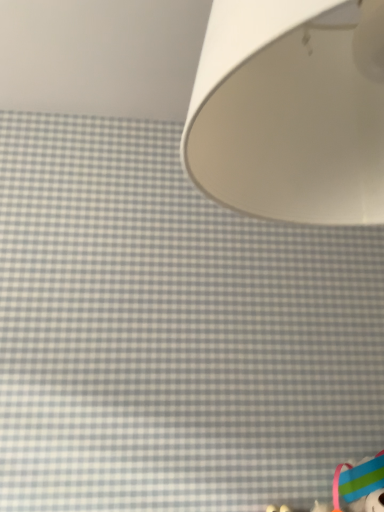
Question: Can you confirm if white matte lampshade at upper right is thinner than rubberized plastic toy at lower right?

Choices:
 (A) yes
 (B) no

Answer: (B)

Question: Does white matte lampshade at upper right have a lesser height compared to rubberized plastic toy at lower right?

Choices:
 (A) yes
 (B) no

Answer: (B)

Question: Is white matte lampshade at upper right at the right side of rubberized plastic toy at lower right?

Choices:
 (A) yes
 (B) no

Answer: (B)

Question: Is white matte lampshade at upper right not close to rubberized plastic toy at lower right?

Choices:
 (A) no
 (B) yes

Answer: (B)

Question: Considering the relative positions of white matte lampshade at upper right and rubberized plastic toy at lower right in the image provided, is white matte lampshade at upper right in front of rubberized plastic toy at lower right?

Choices:
 (A) yes
 (B) no

Answer: (A)

Question: Is white matte lampshade at upper right not within rubberized plastic toy at lower right?

Choices:
 (A) yes
 (B) no

Answer: (A)

Question: Is rubberized plastic toy at lower right positioned with its back to white matte lampshade at upper right?

Choices:
 (A) no
 (B) yes

Answer: (A)

Question: Is rubberized plastic toy at lower right at the left side of white matte lampshade at upper right?

Choices:
 (A) no
 (B) yes

Answer: (A)

Question: Is rubberized plastic toy at lower right aimed at white matte lampshade at upper right?

Choices:
 (A) yes
 (B) no

Answer: (B)

Question: Is rubberized plastic toy at lower right wider than white matte lampshade at upper right?

Choices:
 (A) yes
 (B) no

Answer: (B)

Question: Does rubberized plastic toy at lower right have a greater height compared to white matte lampshade at upper right?

Choices:
 (A) yes
 (B) no

Answer: (B)

Question: Does rubberized plastic toy at lower right have a larger size compared to white matte lampshade at upper right?

Choices:
 (A) no
 (B) yes

Answer: (A)

Question: Based on their positions, is rubberized plastic toy at lower right located to the left or right of white matte lampshade at upper right?

Choices:
 (A) right
 (B) left

Answer: (A)